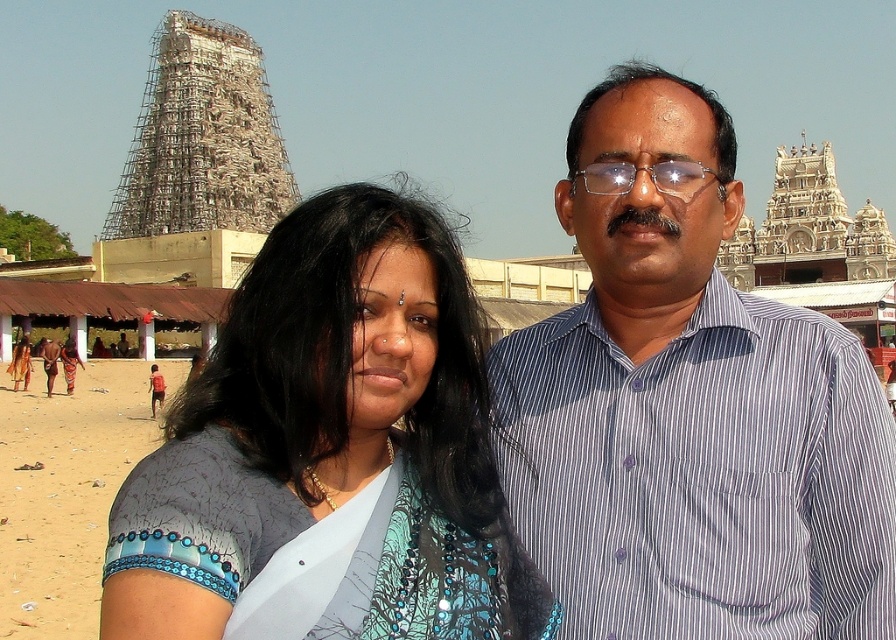
You are a photographer trying to capture a photo of the blue printed saree at center and the blue fabric at lower left. Which one is located to the right of the other?

The blue printed saree at center is positioned on the right side of the blue fabric at lower left.

You are a photographer trying to capture a wide shot of the scene. The blue striped shirt at center and the blue fabric at lower left are both in your frame. Based on their sizes in the image, which object would you focus on first if you want to ensure the larger object is in sharp focus?

The blue fabric at lower left is larger than the blue striped shirt at center, so you should focus on the blue fabric at lower left first to ensure it is in sharp focus.

You are standing at the beach and want to walk towards the two points marked in the image. Which point, point (786, 435) or point (211, 364), is closer to you?

Point (786, 435) is closer to the viewer than point (211, 364).